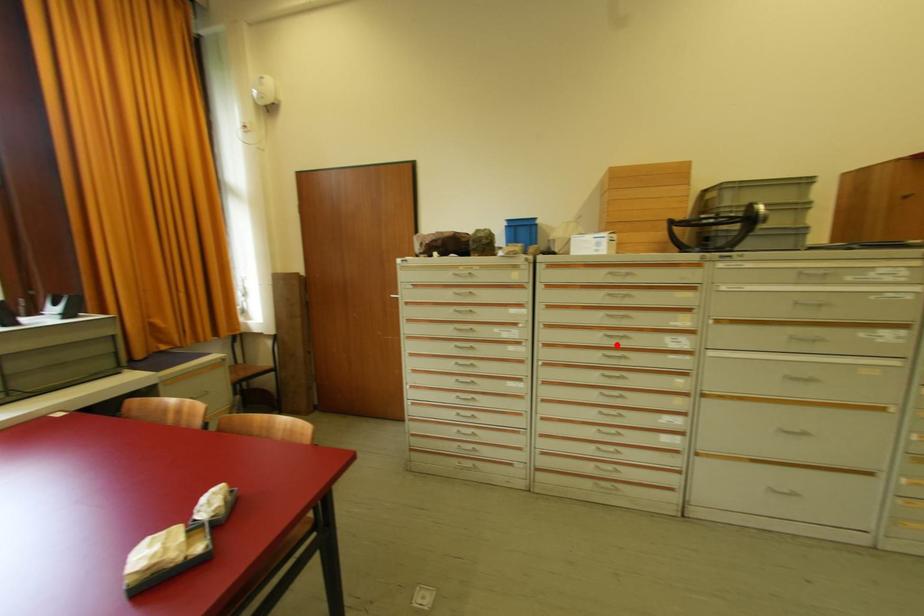
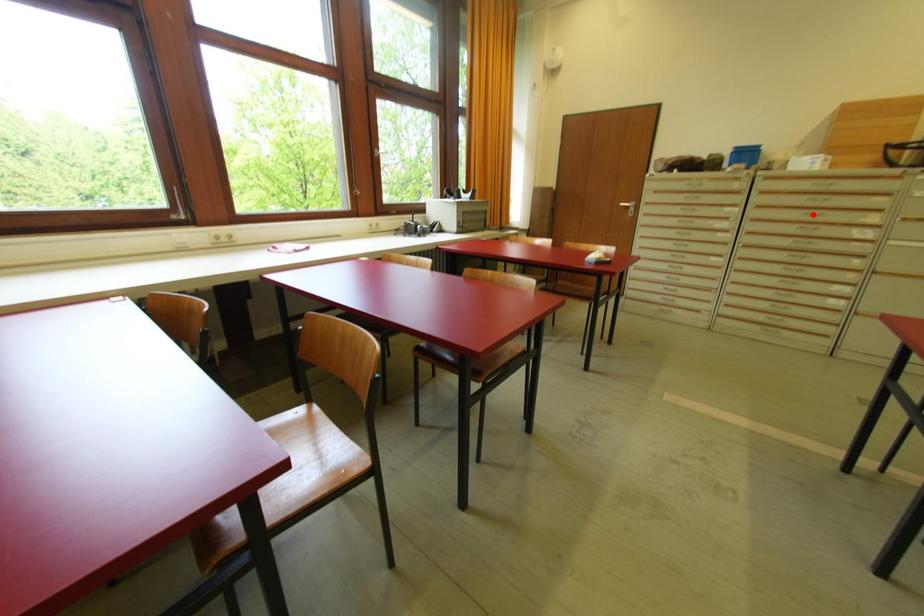
I am providing you with two images of the same scene from different viewpoints. A red point is marked on the first image and another point is marked on the second image. Is the red point in image1 aligned with the point shown in image2?

No